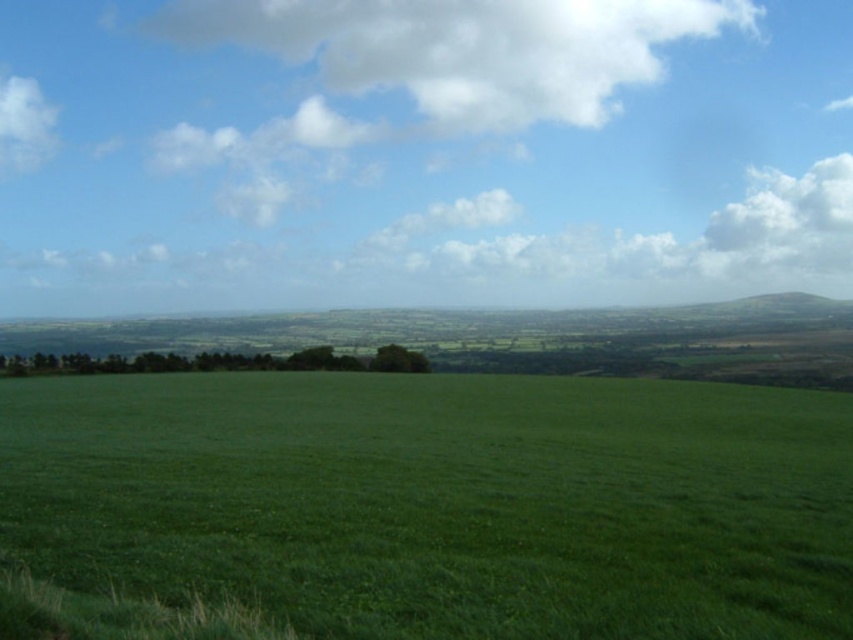
Question: Which of the following is the closest to the observer?

Choices:
 (A) (322, 572)
 (B) (593, 74)
 (C) (239, 266)

Answer: (A)

Question: Is cloudy sky at upper center below white fluffy cloud at upper center?

Choices:
 (A) no
 (B) yes

Answer: (B)

Question: Is white fluffy cloud at upper center in front of white fluffy cloud at upper left?

Choices:
 (A) no
 (B) yes

Answer: (B)

Question: Is cloudy sky at upper center positioned in front of green grassy field at center?

Choices:
 (A) no
 (B) yes

Answer: (A)

Question: Which object is farther from the camera taking this photo?

Choices:
 (A) white fluffy cloud at upper center
 (B) white fluffy cloud at upper left
 (C) cloudy sky at upper center

Answer: (B)

Question: Which object is positioned closest to the green grassy field at center?

Choices:
 (A) cloudy sky at upper center
 (B) white fluffy cloud at upper center

Answer: (A)